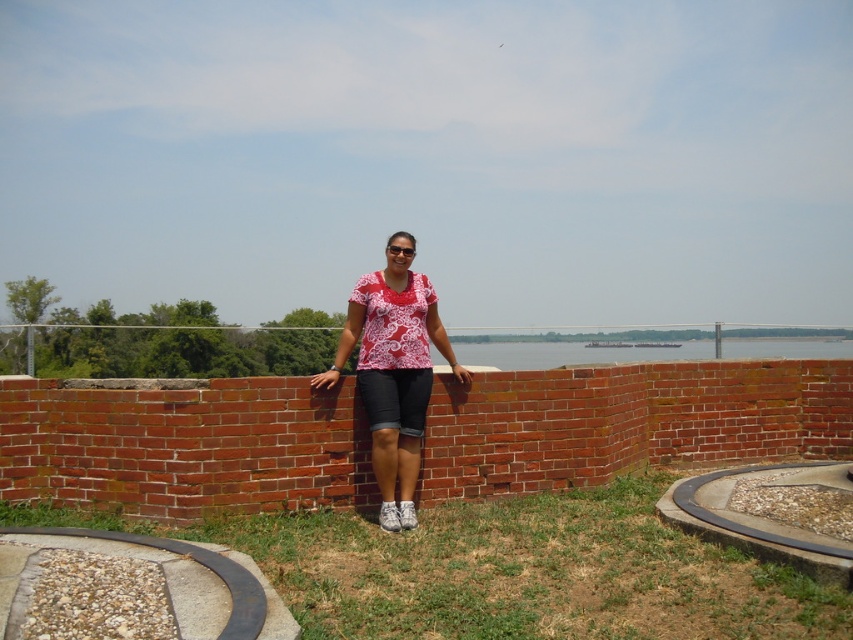
You are standing at the point labeled as point (509, 570) in the image. Looking around, you see the person against the brick wall and the green grass at lower center. What is directly under your feet?

The point (509, 570) indicates green grass at lower center, so the green grass at lower center is directly under your feet.

You are a landscape architect designing a garden. You want to place a 2.5 meter wide decorative fountain between the green grass at lower center and the clear water at center. Will there be enough space between them to fit the fountain?

The green grass at lower center and clear water at center are 7.15 meters apart, so yes, a 2.5 meter wide fountain can fit between them since the distance is greater than the fountain width.

You are a delivery robot with a package that needs to be placed exactly 1.5 meters away from the matte red shirt at center. Can you place the package on the green grass at lower center?

The green grass at lower center is 1.44 meters from the matte red shirt at center, which is slightly closer than the required 1.5 meters. Therefore, placing the package there would not meet the requirement. You need to move it a bit further away from the matte red shirt at center to ensure it is exactly 1.5 meters away.